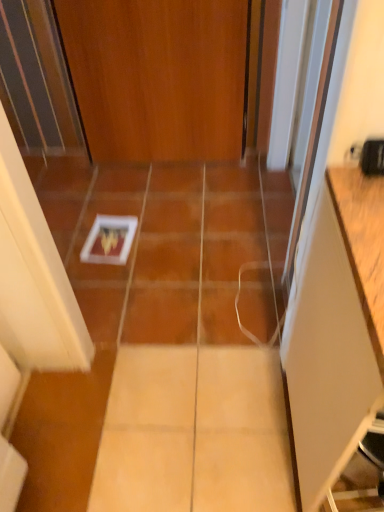
Question: Is white matte cabinet at right next to wooden door at center?

Choices:
 (A) no
 (B) yes

Answer: (A)

Question: From a real-world perspective, is white matte cabinet at right on wooden door at center?

Choices:
 (A) no
 (B) yes

Answer: (A)

Question: Can you confirm if white matte cabinet at right is smaller than wooden door at center?

Choices:
 (A) yes
 (B) no

Answer: (B)

Question: Is white matte cabinet at right far away from wooden door at center?

Choices:
 (A) no
 (B) yes

Answer: (B)

Question: Could wooden door at center be considered to be inside white matte cabinet at right?

Choices:
 (A) yes
 (B) no

Answer: (B)

Question: Is white matte cabinet at right closer to camera compared to wooden door at center?

Choices:
 (A) yes
 (B) no

Answer: (A)

Question: Does wooden door at center appear on the right side of white matte cabinet at right?

Choices:
 (A) yes
 (B) no

Answer: (B)

Question: Does wooden door at center touch white matte cabinet at right?

Choices:
 (A) yes
 (B) no

Answer: (B)

Question: Can you confirm if wooden door at center is wider than white matte cabinet at right?

Choices:
 (A) no
 (B) yes

Answer: (A)

Question: Is wooden door at center completely or partially outside of white matte cabinet at right?

Choices:
 (A) yes
 (B) no

Answer: (A)

Question: Is wooden door at center facing away from white matte cabinet at right?

Choices:
 (A) no
 (B) yes

Answer: (A)

Question: From the image's perspective, would you say wooden door at center is positioned over white matte cabinet at right?

Choices:
 (A) no
 (B) yes

Answer: (B)

Question: Considering the positions of wooden door at center and white matte cabinet at right in the image, is wooden door at center wider or thinner than white matte cabinet at right?

Choices:
 (A) wide
 (B) thin

Answer: (B)